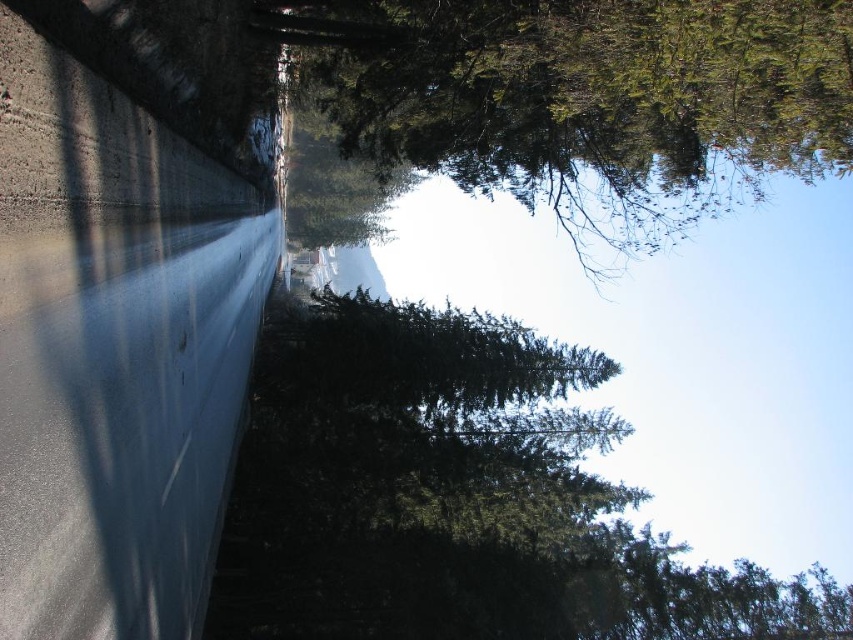
You are standing on the road and looking towards the dense greenery. There are two points marked in the image, point (537,564) and point (692,72). Which point is closer to your current position on the road?

Point (537,564) is further to the camera than point (692,72), so the point closer to your current position on the road is point (692,72).

Consider the image. You are a hiker trying to navigate through the forest. You see a green matte tree at center and a green matte tree at upper center. Which tree would appear closer to you based on their sizes?

The green matte tree at center is bigger than the green matte tree at upper center, so it would appear closer to you.